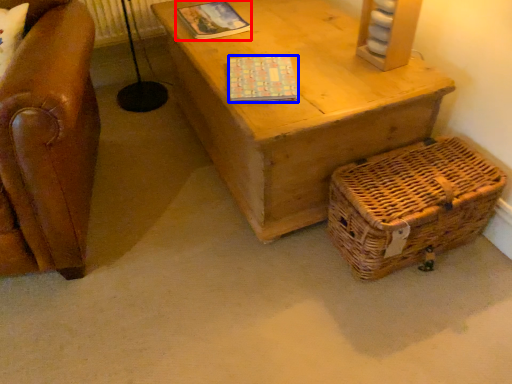
Question: Which of the following is the farthest to the observer, magazine (highlighted by a red box) or magazine (highlighted by a blue box)?

Choices:
 (A) magazine
 (B) magazine

Answer: (A)